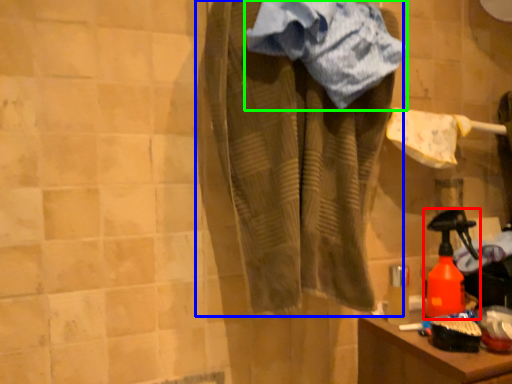
Question: Based on their relative distances, which object is farther from bottle (highlighted by a red box)? Choose from clothing (highlighted by a blue box) and towel (highlighted by a green box).

Choices:
 (A) clothing
 (B) towel

Answer: (B)